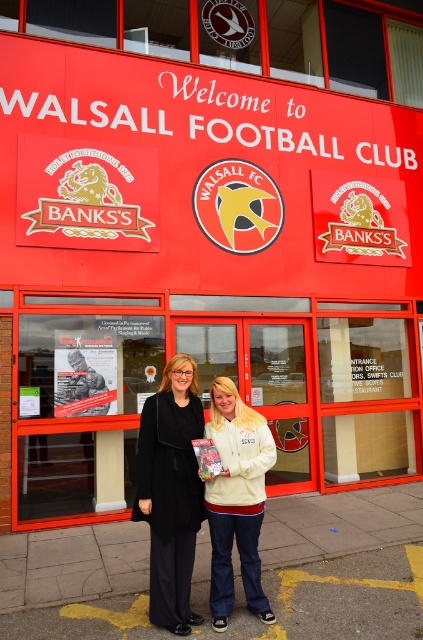
Question: Which object is the closest to the white fleece jacket at center?

Choices:
 (A) red matte building at center
 (B) black fabric coat at center

Answer: (B)

Question: Which point is closer to the camera?

Choices:
 (A) white fleece jacket at center
 (B) red matte building at center
 (C) black fabric coat at center

Answer: (A)

Question: Based on their relative distances, which object is nearer to the black fabric coat at center?

Choices:
 (A) red matte building at center
 (B) white fleece jacket at center

Answer: (B)

Question: Can you confirm if red matte building at center is positioned above white fleece jacket at center?

Choices:
 (A) no
 (B) yes

Answer: (B)

Question: In this image, where is red matte building at center located relative to black fabric coat at center?

Choices:
 (A) below
 (B) above

Answer: (B)

Question: In this image, where is white fleece jacket at center located relative to black fabric coat at center?

Choices:
 (A) below
 (B) above

Answer: (A)